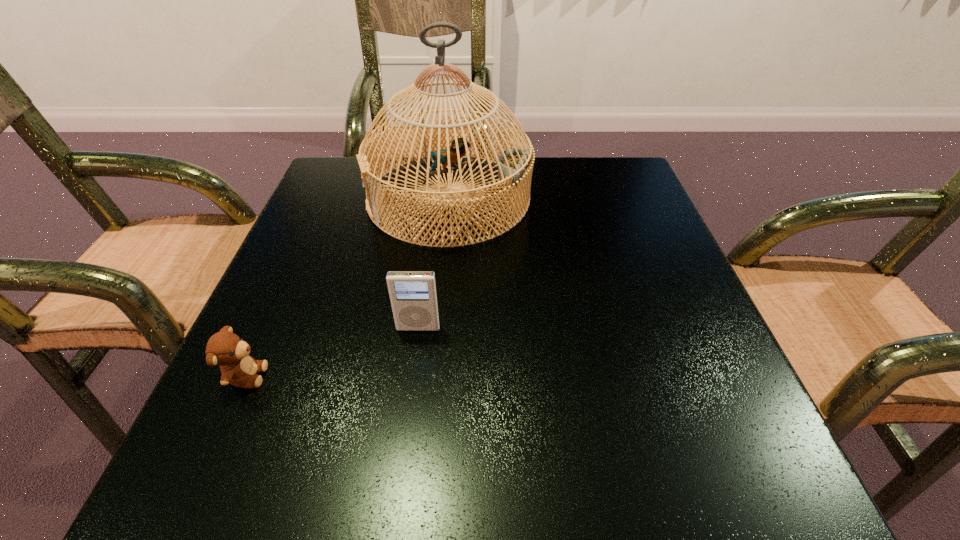
Find the location of a particular element. The height and width of the screenshot is (540, 960). the farthest object is located at coordinates (515, 165).

Where is `the tallest object`? Image resolution: width=960 pixels, height=540 pixels. the tallest object is located at coordinates (515, 165).

The width and height of the screenshot is (960, 540). I want to click on the second tallest object, so click(413, 294).

You are a GUI agent. You are given a task and a screenshot of the screen. Output one action in this format:
    pyautogui.click(x=<x>, y=<y>)
    Task: Click on the second farthest object
    The image size is (960, 540).
    Given the screenshot: What is the action you would take?
    pyautogui.click(x=413, y=294)

This screenshot has height=540, width=960. I want to click on the nearest object, so click(x=229, y=351).

Find the location of a particular element. Image resolution: width=960 pixels, height=540 pixels. the leftmost object is located at coordinates (229, 351).

Identify the location of free region located 0.200m on the right of the birdcage. (619, 198).

The height and width of the screenshot is (540, 960). I want to click on vacant area located on the front-facing side of the second nearest object, so click(410, 392).

Identify the location of vacant area located 0.050m on the face of the teddy bear. (300, 376).

What are the coordinates of `object at the far edge` in the screenshot? It's located at (515, 165).